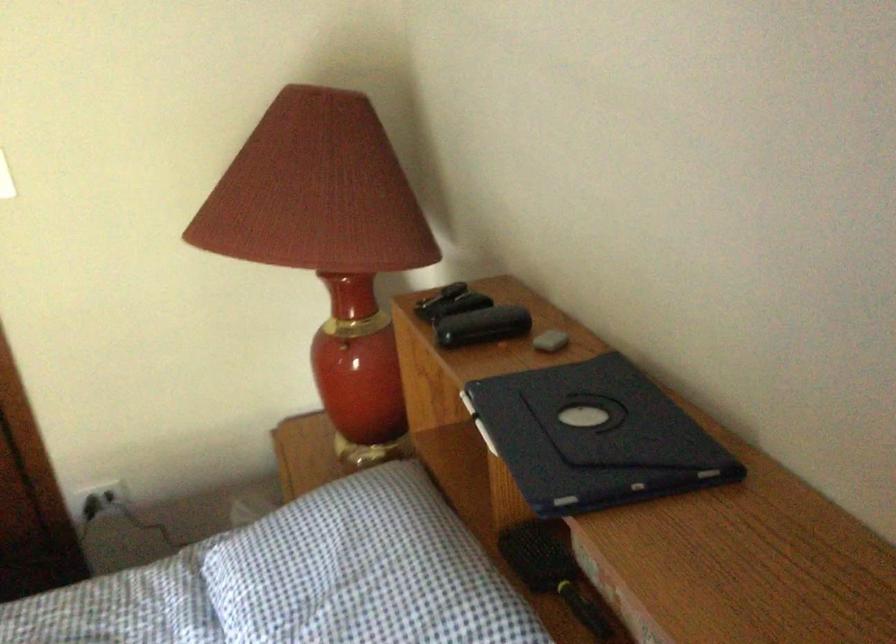
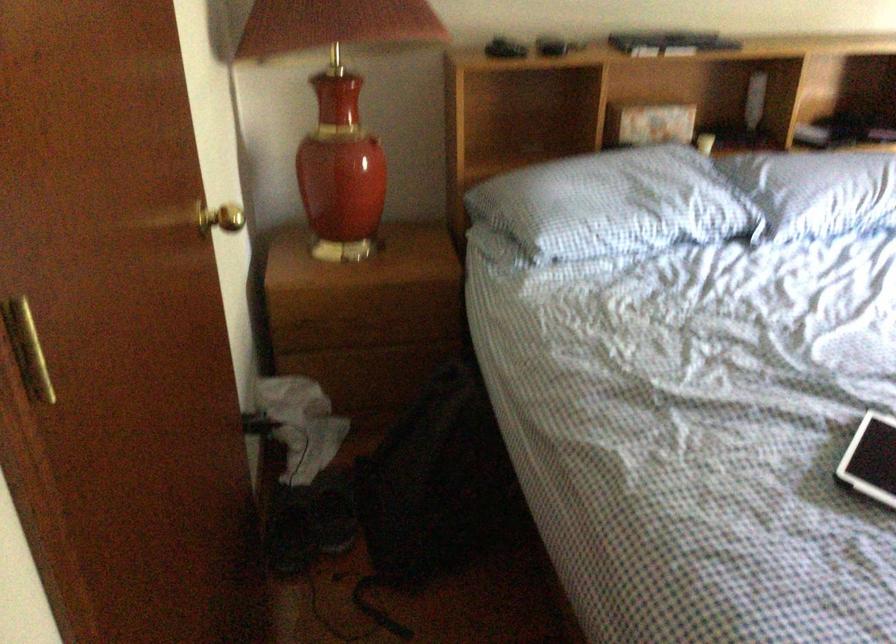
Where in the second image is the point corresponding to [295,574] from the first image?

(613, 204)